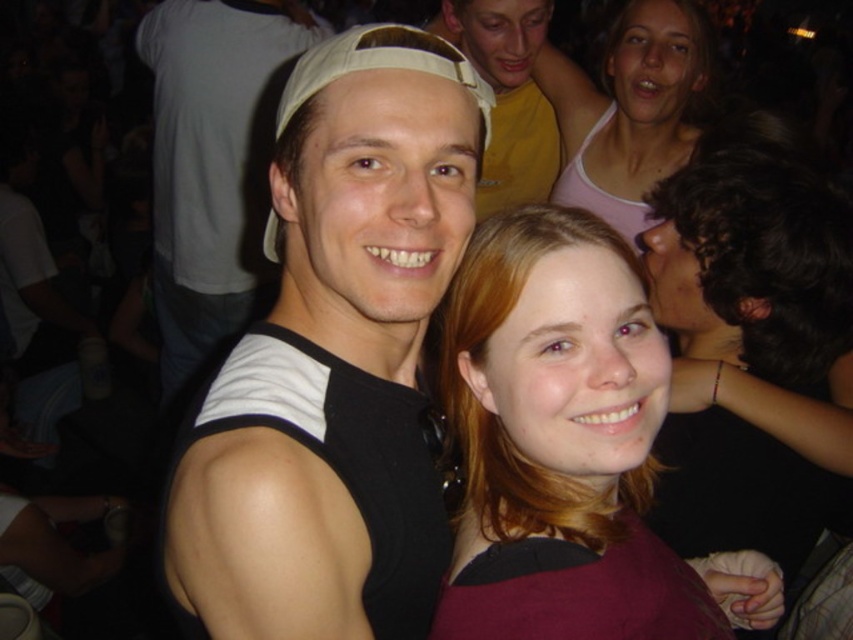
Who is higher up, matte burgundy sweater at center or yellow matte shirt at upper center?

yellow matte shirt at upper center is above.

Does matte burgundy sweater at center lie behind yellow matte shirt at upper center?

That is False.

You are a GUI agent. You are given a task and a screenshot of the screen. Output one action in this format:
    pyautogui.click(x=<x>, y=<y>)
    Task: Click on the matte burgundy sweater at center
    The height and width of the screenshot is (640, 853).
    Given the screenshot: What is the action you would take?
    566,448

Who is positioned more to the left, blonde hair at center or pink cotton tank top at upper right?

Positioned to the left is blonde hair at center.

Between blonde hair at center and pink cotton tank top at upper right, which one has less height?

pink cotton tank top at upper right is shorter.

Is point (659, 227) more distant than point (625, 72)?

No.

The image size is (853, 640). Find the location of `blonde hair at center`. blonde hair at center is located at coordinates (752, 349).

Is point (320, 481) positioned after point (511, 624)?

Yes, point (320, 481) is farther from viewer.

Does black matte tank top at center have a smaller size compared to matte burgundy sweater at center?

A: Indeed, black matte tank top at center has a smaller size compared to matte burgundy sweater at center.

Image resolution: width=853 pixels, height=640 pixels. I want to click on black matte tank top at center, so click(x=334, y=360).